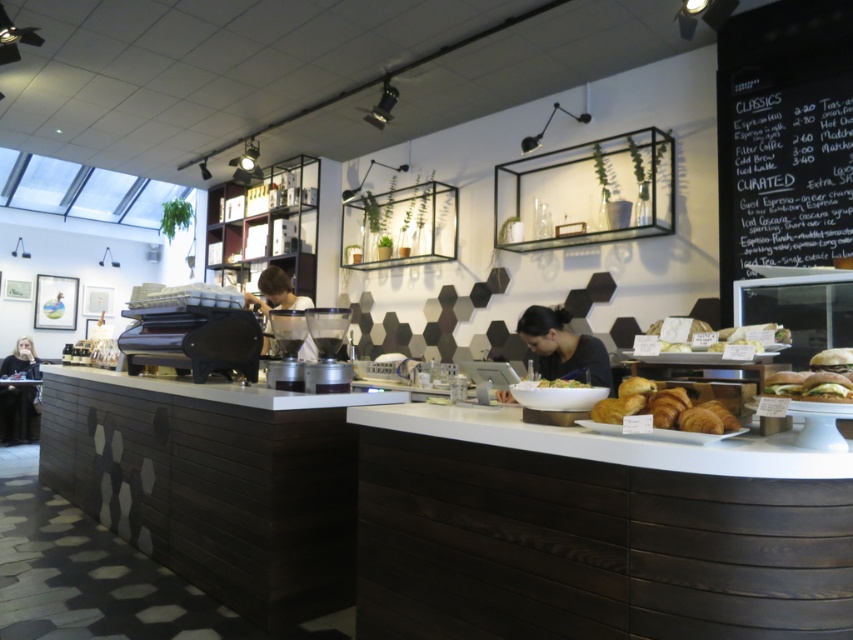
Question: Which object is farther from the camera taking this photo?

Choices:
 (A) matte black coffee machine at center
 (B) green leafy lettuce at right
 (C) matte black jacket at lower left
 (D) matte black laptop at center

Answer: (C)

Question: Can you confirm if golden brown croissant at center is positioned below green matte salad bowl at center?

Choices:
 (A) yes
 (B) no

Answer: (A)

Question: Among these objects, which one is farthest from the camera?

Choices:
 (A) black chalkboard at upper right
 (B) matte black coffee machine at center
 (C) white paper bag at center

Answer: (B)

Question: Is white paper bag at center above green matte salad bowl at center?

Choices:
 (A) yes
 (B) no

Answer: (A)

Question: Which of the following is the closest to the observer?

Choices:
 (A) (653, 323)
 (B) (566, 387)
 (C) (706, 385)
 (D) (26, 412)

Answer: (C)

Question: Does black chalkboard at upper right have a greater width compared to matte black laptop at center?

Choices:
 (A) no
 (B) yes

Answer: (A)